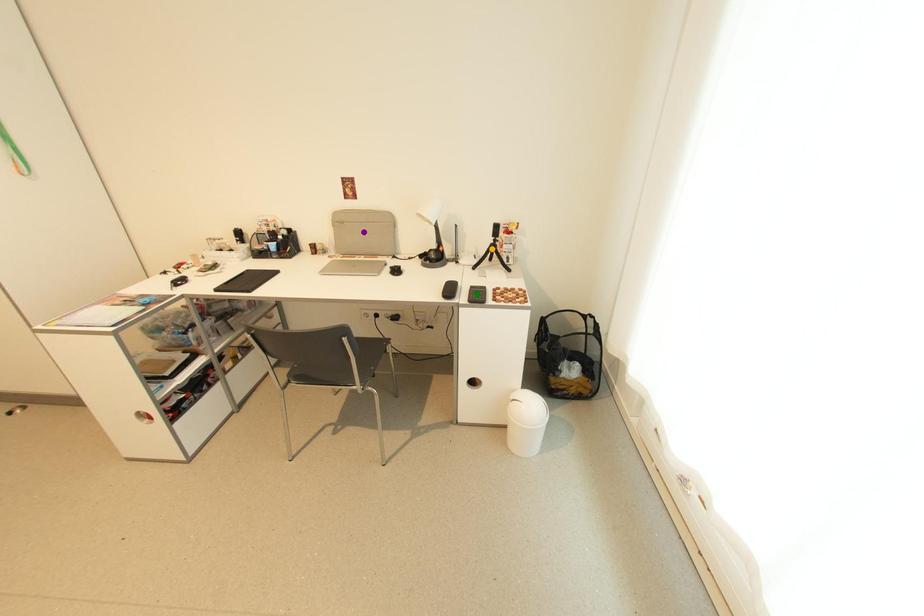
Order these from farthest to nearest:
A) purple point
B) orange point
C) green point

purple point, orange point, green point